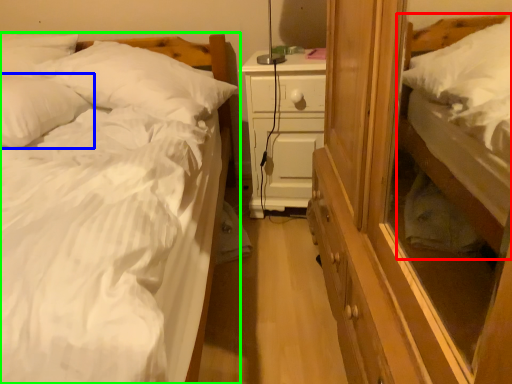
Question: Which object is the closest to the bed (highlighted by a red box)? Choose among these: pillow (highlighted by a blue box) or bed (highlighted by a green box).

Choices:
 (A) pillow
 (B) bed

Answer: (B)